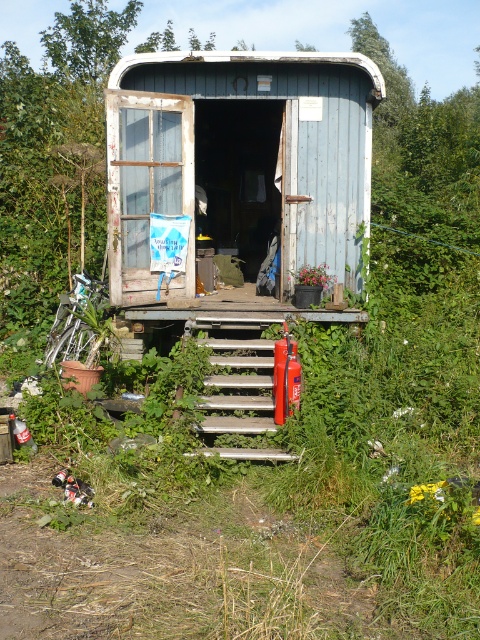
Does point (320, 129) come closer to viewer compared to point (298, 396)?

That is False.

Is wooden cabin at center bigger than red matte extinguisher at center?

Yes.

Where is `wooden cabin at center`? This screenshot has height=640, width=480. wooden cabin at center is located at coordinates (239, 161).

Which is in front, point (243, 205) or point (276, 317)?

Point (276, 317)

Can you confirm if wooden cabin at center is positioned below metallic silver stairs at center?

Actually, wooden cabin at center is above metallic silver stairs at center.

The height and width of the screenshot is (640, 480). Describe the element at coordinates (239, 161) in the screenshot. I see `wooden cabin at center` at that location.

I want to click on wooden cabin at center, so click(x=239, y=161).

Who is positioned more to the left, red matte fire extinguisher at center or red matte extinguisher at center?

Positioned to the left is red matte fire extinguisher at center.

Which of these two, red matte fire extinguisher at center or red matte extinguisher at center, stands shorter?

With less height is red matte extinguisher at center.

What do you see at coordinates (286, 376) in the screenshot?
I see `red matte fire extinguisher at center` at bounding box center [286, 376].

At what (x,y) coordinates should I click in order to perform the action: click on red matte fire extinguisher at center. Please return your answer as a coordinate pair (x, y). This screenshot has width=480, height=640. Looking at the image, I should click on (286, 376).